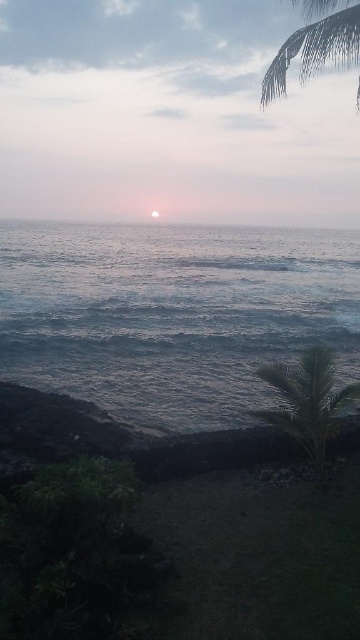
You are standing at the center of the image and want to walk towards the green leafy palm tree at lower right and the green leafy palm at upper right. Which palm tree will you see first as you look towards the right side of the image?

The green leafy palm at upper right will be seen first because the green leafy palm tree at lower right is positioned to its left, meaning the upper palm is closer to the right side of the image.